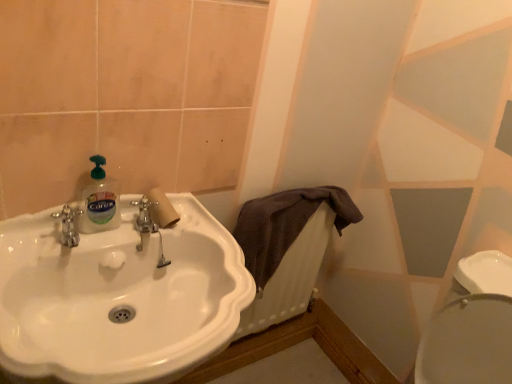
Locate an element on the screen. This screenshot has width=512, height=384. vacant space to the right of translucent plastic bottle at sink left is located at coordinates (155, 234).